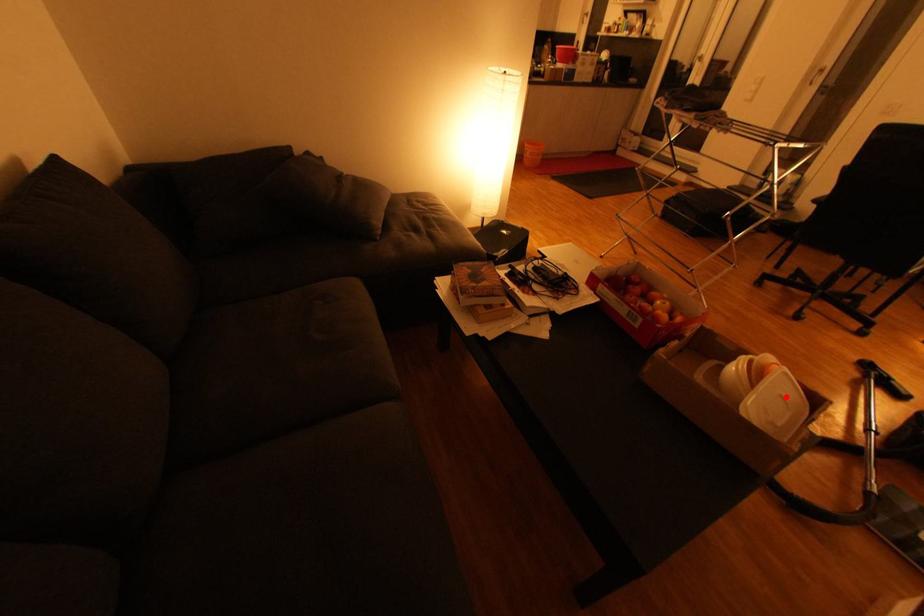
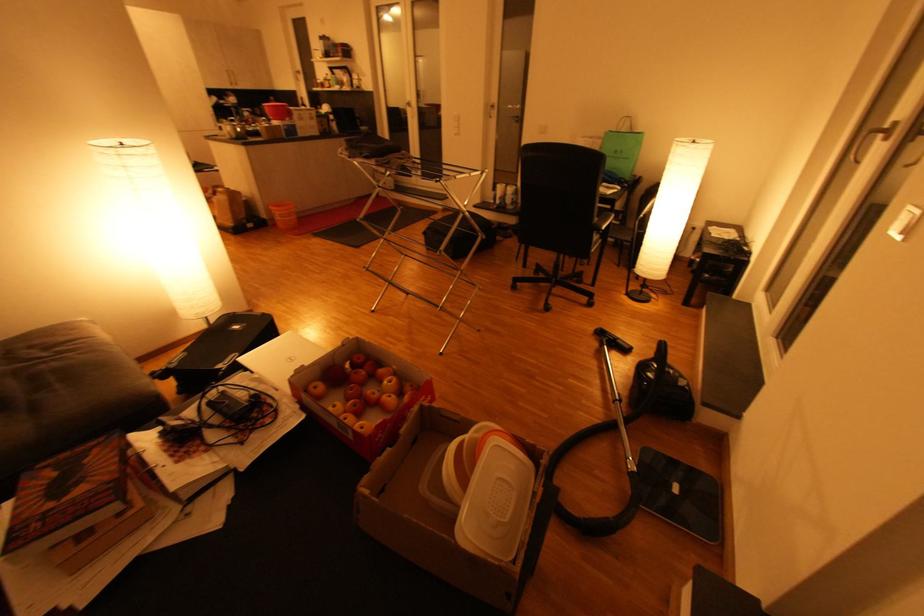
Question: I am providing you with two images of the same scene from different viewpoints. Image1 has a red point marked. In image2, the corresponding 3D location appears at what relative position? Reply with the corresponding letter.

Choices:
 (A) Closer
 (B) Farther

Answer: (B)